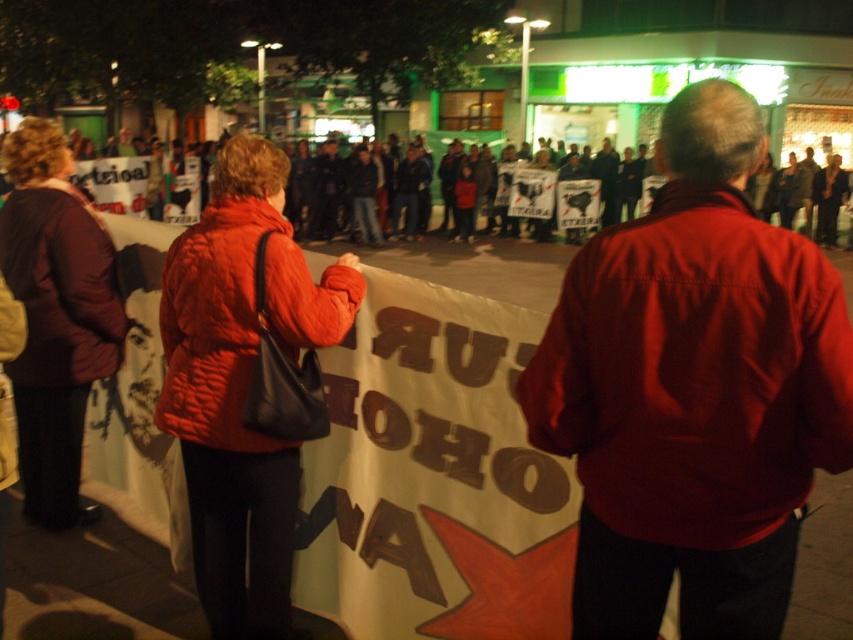
Question: Among these objects, which one is nearest to the camera?

Choices:
 (A) matte red jacket at center
 (B) quilted red jacket at center

Answer: (A)

Question: Which of the following is the closest to the observer?

Choices:
 (A) quilted red jacket at center
 (B) matte red jacket at center
 (C) maroon fabric jacket at left

Answer: (B)

Question: Does matte red jacket at center lie in front of maroon fabric jacket at left?

Choices:
 (A) no
 (B) yes

Answer: (B)

Question: From the image, what is the correct spatial relationship of quilted red jacket at center in relation to maroon fabric jacket at left?

Choices:
 (A) above
 (B) below

Answer: (B)

Question: Which of the following is the farthest from the observer?

Choices:
 (A) quilted red jacket at center
 (B) matte red jacket at center
 (C) maroon fabric jacket at left

Answer: (C)

Question: Does matte red jacket at center appear on the left side of quilted red jacket at center?

Choices:
 (A) yes
 (B) no

Answer: (B)